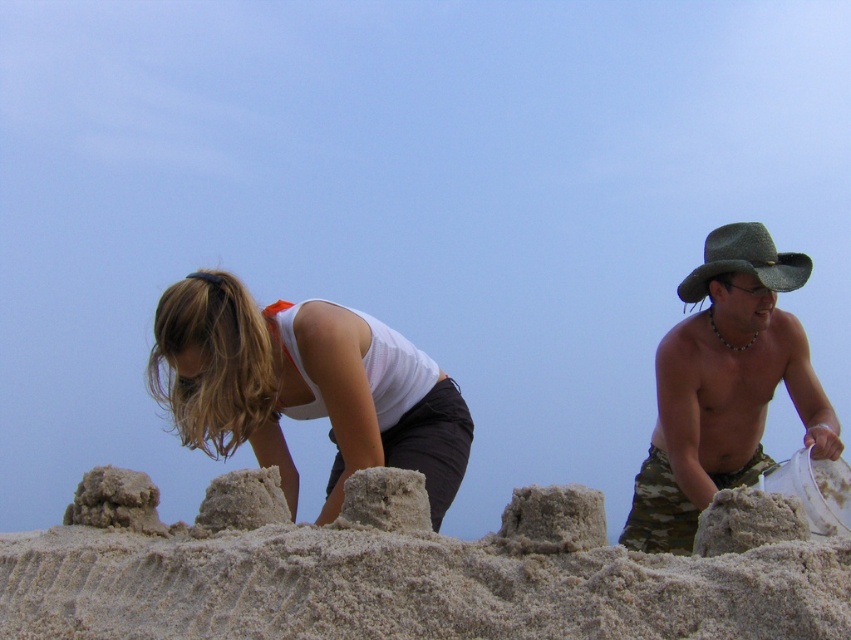
Does camouflage shorts at right appear on the left side of green felt cowboy hat at right?

Correct, you'll find camouflage shorts at right to the left of green felt cowboy hat at right.

Can you confirm if camouflage shorts at right is positioned above green felt cowboy hat at right?

No, camouflage shorts at right is not above green felt cowboy hat at right.

Describe the element at coordinates (724, 387) in the screenshot. I see `camouflage shorts at right` at that location.

This screenshot has height=640, width=851. I want to click on camouflage shorts at right, so click(x=724, y=387).

Is white matte tank top at center bigger than green felt cowboy hat at right?

Yes.

Describe the element at coordinates (298, 388) in the screenshot. I see `white matte tank top at center` at that location.

This screenshot has height=640, width=851. Describe the element at coordinates (298, 388) in the screenshot. I see `white matte tank top at center` at that location.

Locate an element on the screen. white matte tank top at center is located at coordinates (298, 388).

Is white matte tank top at center smaller than camouflage shorts at right?

Indeed, white matte tank top at center has a smaller size compared to camouflage shorts at right.

Who is more distant from viewer, (x=216, y=356) or (x=701, y=291)?

The point (x=701, y=291) is more distant.

Consider the image. Measure the distance between white matte tank top at center and camera.

The distance of white matte tank top at center from camera is 6.78 meters.

The height and width of the screenshot is (640, 851). In order to click on white matte tank top at center in this screenshot , I will do `click(298, 388)`.